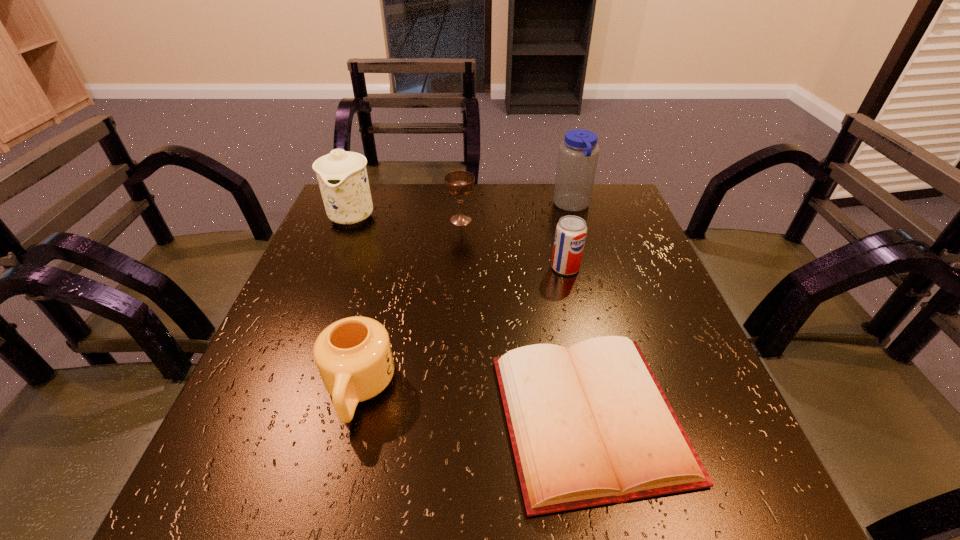
Where is `object that is the second closest to the water bottle`? object that is the second closest to the water bottle is located at coordinates (459, 183).

Point out which object is positioned as the third nearest to the soda. Please provide its 2D coordinates. Your answer should be formatted as a tuple, i.e. [(x, y)], where the tuple contains the x and y coordinates of a point satisfying the conditions above.

[(459, 183)]

What are the coordinates of `free location that satisfies the following two spatial constraints: 1. on the back side of the Bible; 2. on the left side of the soda` in the screenshot? It's located at (559, 267).

You are a GUI agent. You are given a task and a screenshot of the screen. Output one action in this format:
    pyautogui.click(x=<x>, y=<y>)
    Task: Click on the vacant region that satisfies the following two spatial constraints: 1. on the spout of the shortest object; 2. on the right side of the chinaware
    The image size is (960, 540).
    Given the screenshot: What is the action you would take?
    pyautogui.click(x=273, y=417)

This screenshot has width=960, height=540. Identify the location of vacant space that satisfies the following two spatial constraints: 1. with a carrying loop on the side of the water bottle; 2. on the handle side of the fifth object from right to left. (626, 390).

Image resolution: width=960 pixels, height=540 pixels. I want to click on vacant space that satisfies the following two spatial constraints: 1. with a carrying loop on the side of the water bottle; 2. on the handle side of the fifth object from right to left, so click(626, 390).

The width and height of the screenshot is (960, 540). Identify the location of vacant space that satisfies the following two spatial constraints: 1. on the spout of the soda; 2. on the left side of the leftmost object. (331, 267).

At what (x,y) coordinates should I click in order to perform the action: click on free spot that satisfies the following two spatial constraints: 1. on the handle side of the Bible; 2. on the left side of the mug. Please return your answer as a coordinate pair (x, y). Image resolution: width=960 pixels, height=540 pixels. Looking at the image, I should click on (352, 417).

The width and height of the screenshot is (960, 540). What are the coordinates of `free point that satisfies the following two spatial constraints: 1. on the handle side of the fifth object from right to left; 2. on the left side of the shortest object` in the screenshot? It's located at (352, 417).